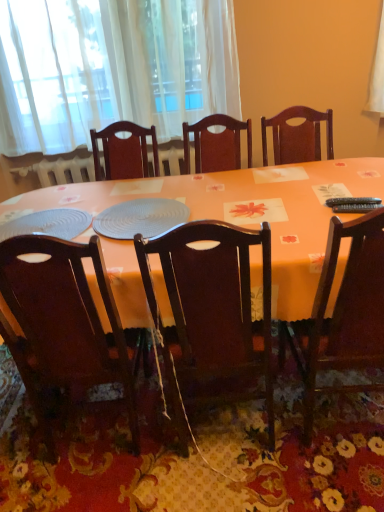
Where is `free space to the back side of black plastic remote control at right, which is counted as the 2th remote control, starting from the top`? This screenshot has height=512, width=384. free space to the back side of black plastic remote control at right, which is counted as the 2th remote control, starting from the top is located at coordinates coord(341,194).